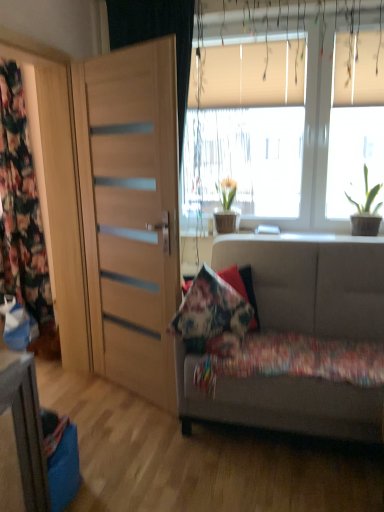
Question: In terms of height, does floral fabric pillow at center look taller or shorter compared to green matte plant at center, which is counted as the 2th houseplant, starting from the front?

Choices:
 (A) short
 (B) tall

Answer: (B)

Question: From a real-world perspective, is floral fabric pillow at center physically located above or below green matte plant at center, which appears as the first houseplant when viewed from the left?

Choices:
 (A) below
 (B) above

Answer: (A)

Question: Which is farther from the floral fabric cushion at lower right?

Choices:
 (A) floral fabric curtain at left
 (B) green matte plant at center, which appears as the first houseplant when viewed from the left
 (C) light wood door at left
 (D) floral fabric pillow at center
 (E) white matte window at upper center

Answer: (A)

Question: Which object is the farthest from the light wood door at left?

Choices:
 (A) green matte plant at upper right, positioned as the 1th houseplant in right-to-left order
 (B) floral fabric cushion at lower right
 (C) floral fabric curtain at left
 (D) white matte window at upper center
 (E) floral fabric pillow at center

Answer: (A)